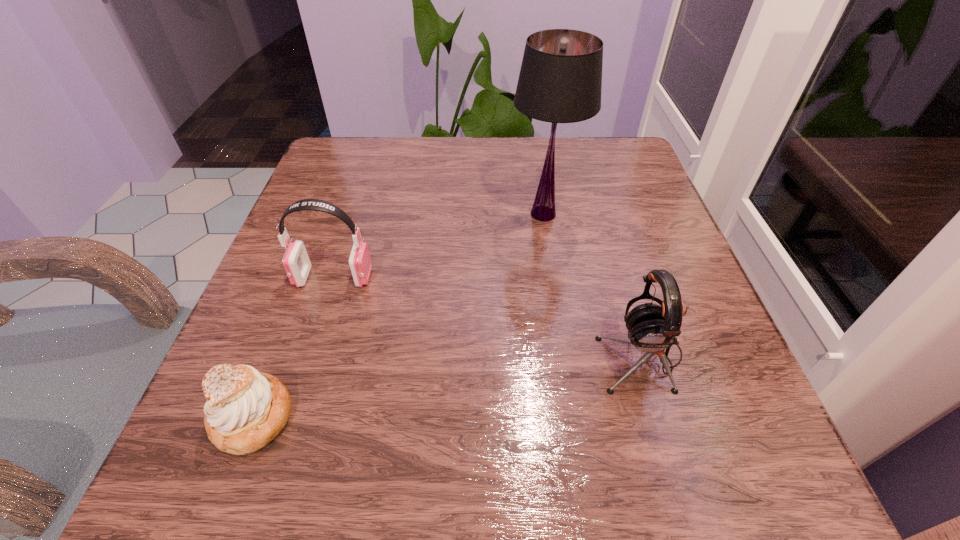
At what (x,y) coordinates should I click in order to perform the action: click on vacant region located on the outer surface of the third nearest object. Please return your answer as a coordinate pair (x, y). This screenshot has width=960, height=540. Looking at the image, I should click on (433, 278).

This screenshot has height=540, width=960. I want to click on vacant region located on the right of the shortest object, so click(x=573, y=417).

I want to click on object that is at the far edge, so click(x=560, y=81).

Locate an element on the screen. The width and height of the screenshot is (960, 540). object at the near edge is located at coordinates (245, 410).

This screenshot has height=540, width=960. What are the coordinates of `earphone at the left edge` in the screenshot? It's located at [x=296, y=262].

The height and width of the screenshot is (540, 960). Find the location of `pastry that is positioned at the left edge`. pastry that is positioned at the left edge is located at coordinates (245, 410).

I want to click on object that is at the right edge, so click(652, 328).

Where is `object located at the near left corner`? The height and width of the screenshot is (540, 960). object located at the near left corner is located at coordinates (245, 410).

Find the location of a particular element. free point at the far edge is located at coordinates (536, 136).

Find the location of a particular element. This screenshot has height=540, width=960. free region at the near edge of the desktop is located at coordinates (590, 453).